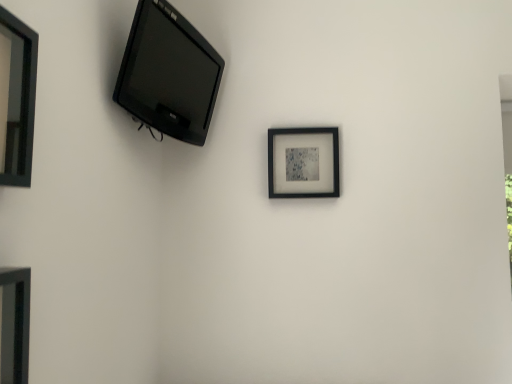
Measure the distance between point (144, 122) and camera.

The depth of point (144, 122) is 1.25 meters.

What is the approximate width of matte black tv at upper left?

It is 17.48 centimeters.

What do you see at coordinates (303, 162) in the screenshot?
I see `black matte picture frame at center, positioned as the first picture frame in back-to-front order` at bounding box center [303, 162].

How much space does black matte picture frame at center, the third picture frame in the left-to-right sequence, occupy vertically?

black matte picture frame at center, the third picture frame in the left-to-right sequence, is 10.20 inches in height.

This screenshot has width=512, height=384. What are the coordinates of `black glossy picture frame at upper left, the 2th picture frame when ordered from front to back` in the screenshot? It's located at (17, 99).

In order to click on matte black picture frame at lower left, which appears as the second picture frame when viewed from the right in this screenshot , I will do `click(14, 324)`.

I want to click on matte black tv at upper left, so click(168, 74).

Considering the sizes of objects black matte picture frame at center, the 1th picture frame when ordered from right to left, and matte black tv at upper left in the image provided, who is bigger, black matte picture frame at center, the 1th picture frame when ordered from right to left, or matte black tv at upper left?

matte black tv at upper left is bigger.

Considering the positions of objects black matte picture frame at center, the 1th picture frame when ordered from right to left, and matte black tv at upper left in the image provided, who is more to the left, black matte picture frame at center, the 1th picture frame when ordered from right to left, or matte black tv at upper left?

From the viewer's perspective, matte black tv at upper left appears more on the left side.

Who is taller, black matte picture frame at center, positioned as the first picture frame in back-to-front order, or matte black tv at upper left?

With more height is matte black tv at upper left.

Measure the distance from black matte picture frame at center, the third picture frame in the left-to-right sequence, to matte black tv at upper left.

black matte picture frame at center, the third picture frame in the left-to-right sequence, and matte black tv at upper left are 16.65 inches apart from each other.

Is black matte picture frame at center, the 1th picture frame when ordered from right to left, at the left side of matte black picture frame at lower left, which appears as the second picture frame when viewed from the right?

In fact, black matte picture frame at center, the 1th picture frame when ordered from right to left, is to the right of matte black picture frame at lower left, which appears as the second picture frame when viewed from the right.

Does black matte picture frame at center, the 1th picture frame when ordered from right to left, have a lesser height compared to matte black picture frame at lower left, marked as the 2th picture frame in a left-to-right arrangement?

Yes, black matte picture frame at center, the 1th picture frame when ordered from right to left, is shorter than matte black picture frame at lower left, marked as the 2th picture frame in a left-to-right arrangement.

Is black matte picture frame at center, positioned as the first picture frame in back-to-front order, smaller than matte black picture frame at lower left, which appears as the second picture frame when viewed from the right?

Correct, black matte picture frame at center, positioned as the first picture frame in back-to-front order, occupies less space than matte black picture frame at lower left, which appears as the second picture frame when viewed from the right.

Which object is wider, black matte picture frame at center, the 1th picture frame when ordered from right to left, or matte black picture frame at lower left, which appears as the second picture frame when viewed from the right?

matte black picture frame at lower left, which appears as the second picture frame when viewed from the right, is wider.

Considering the relative sizes of black glossy picture frame at upper left, which appears as the first picture frame when viewed from the left, and matte black picture frame at lower left, positioned as the third picture frame in back-to-front order, in the image provided, is black glossy picture frame at upper left, which appears as the first picture frame when viewed from the left, thinner than matte black picture frame at lower left, positioned as the third picture frame in back-to-front order,?

Indeed, black glossy picture frame at upper left, which appears as the first picture frame when viewed from the left, has a lesser width compared to matte black picture frame at lower left, positioned as the third picture frame in back-to-front order.

Is black glossy picture frame at upper left, marked as the 3th picture frame in a right-to-left arrangement, positioned with its back to matte black picture frame at lower left, which appears as the second picture frame when viewed from the right?

No, black glossy picture frame at upper left, marked as the 3th picture frame in a right-to-left arrangement,'s orientation is not away from matte black picture frame at lower left, which appears as the second picture frame when viewed from the right.

Based on the photo, considering the sizes of objects black glossy picture frame at upper left, the 2th picture frame when ordered from front to back, and matte black picture frame at lower left, which appears as the second picture frame when viewed from the right, in the image provided, who is smaller, black glossy picture frame at upper left, the 2th picture frame when ordered from front to back, or matte black picture frame at lower left, which appears as the second picture frame when viewed from the right,?

black glossy picture frame at upper left, the 2th picture frame when ordered from front to back, is smaller.

Can you tell me how much black glossy picture frame at upper left, the 2th picture frame when ordered from front to back, and matte black picture frame at lower left, which appears as the second picture frame when viewed from the right, differ in facing direction?

There is a 0.00387-degree angle between the facing directions of black glossy picture frame at upper left, the 2th picture frame when ordered from front to back, and matte black picture frame at lower left, which appears as the second picture frame when viewed from the right.

Can you tell me how much matte black tv at upper left and matte black picture frame at lower left, which appears as the second picture frame when viewed from the right, differ in facing direction?

There is a 16.3-degree angle between the facing directions of matte black tv at upper left and matte black picture frame at lower left, which appears as the second picture frame when viewed from the right.

Between matte black tv at upper left and matte black picture frame at lower left, positioned as the third picture frame in back-to-front order, which one is positioned in front?

matte black picture frame at lower left, positioned as the third picture frame in back-to-front order, is in front.

Is point (152, 27) closer or farther from the camera than point (12, 298)?

Clearly, point (152, 27) is more distant from the camera than point (12, 298).

Is matte black tv at upper left thinner than matte black picture frame at lower left, which appears as the second picture frame when viewed from the right?

No.

Which of these two, matte black tv at upper left or black matte picture frame at center, positioned as the first picture frame in back-to-front order, is wider?

matte black tv at upper left is wider.

Which object is more forward, matte black tv at upper left or black matte picture frame at center, the third picture frame in the front-to-back sequence?

matte black tv at upper left is more forward.

Which of these two, matte black tv at upper left or black matte picture frame at center, the third picture frame in the front-to-back sequence, is bigger?

matte black tv at upper left.

In the scene shown: From a real-world perspective, is matte black picture frame at lower left, which is counted as the 1th picture frame, starting from the front, beneath matte black tv at upper left?

Yes, from a real-world perspective, matte black picture frame at lower left, which is counted as the 1th picture frame, starting from the front, is below matte black tv at upper left.

Is matte black picture frame at lower left, which appears as the second picture frame when viewed from the right, not inside matte black tv at upper left?

matte black picture frame at lower left, which appears as the second picture frame when viewed from the right, is positioned outside matte black tv at upper left.

Can you confirm if matte black picture frame at lower left, positioned as the third picture frame in back-to-front order, is positioned to the right of matte black tv at upper left?

No, matte black picture frame at lower left, positioned as the third picture frame in back-to-front order, is not to the right of matte black tv at upper left.

Is matte black tv at upper left situated inside black glossy picture frame at upper left, the 2th picture frame when ordered from front to back, or outside?

matte black tv at upper left is spatially situated outside black glossy picture frame at upper left, the 2th picture frame when ordered from front to back.

Measure the distance from matte black tv at upper left to black glossy picture frame at upper left, marked as the 3th picture frame in a right-to-left arrangement.

matte black tv at upper left and black glossy picture frame at upper left, marked as the 3th picture frame in a right-to-left arrangement, are 23.37 inches apart.

Does matte black tv at upper left turn towards black glossy picture frame at upper left, which appears as the 2th picture frame when viewed from the back?

No, matte black tv at upper left is not aimed at black glossy picture frame at upper left, which appears as the 2th picture frame when viewed from the back.

Does matte black tv at upper left have a greater height compared to black glossy picture frame at upper left, which appears as the first picture frame when viewed from the left?

Yes.

At what (x,y) coordinates should I click in order to perform the action: click on television above the black matte picture frame at center, the 1th picture frame when ordered from right to left (from a real-world perspective). Please return your answer as a coordinate pair (x, y). Looking at the image, I should click on (168, 74).

The width and height of the screenshot is (512, 384). In order to click on the 2nd picture frame in front of the black matte picture frame at center, positioned as the first picture frame in back-to-front order, starting your count from the anchor in this screenshot , I will do `click(14, 324)`.

Estimate the real-world distances between objects in this image. Which object is further from matte black tv at upper left, black glossy picture frame at upper left, the 2th picture frame when ordered from front to back, or matte black picture frame at lower left, positioned as the third picture frame in back-to-front order?

matte black picture frame at lower left, positioned as the third picture frame in back-to-front order, is positioned further to the anchor matte black tv at upper left.

Looking at the image, which one is located further to black matte picture frame at center, the third picture frame in the front-to-back sequence, black glossy picture frame at upper left, marked as the 3th picture frame in a right-to-left arrangement, or matte black tv at upper left?

black glossy picture frame at upper left, marked as the 3th picture frame in a right-to-left arrangement, is further to black matte picture frame at center, the third picture frame in the front-to-back sequence.

Which object lies nearer to the anchor point matte black tv at upper left, black glossy picture frame at upper left, which appears as the 2th picture frame when viewed from the back, or black matte picture frame at center, the third picture frame in the left-to-right sequence?

Based on the image, black matte picture frame at center, the third picture frame in the left-to-right sequence, appears to be nearer to matte black tv at upper left.

Which object lies further to the anchor point black glossy picture frame at upper left, which appears as the first picture frame when viewed from the left, matte black picture frame at lower left, which is counted as the 1th picture frame, starting from the front, or black matte picture frame at center, the third picture frame in the left-to-right sequence?

The object further to black glossy picture frame at upper left, which appears as the first picture frame when viewed from the left, is black matte picture frame at center, the third picture frame in the left-to-right sequence.

Considering their positions, is matte black tv at upper left positioned closer to matte black picture frame at lower left, marked as the 2th picture frame in a left-to-right arrangement, than black glossy picture frame at upper left, the 2th picture frame when ordered from front to back?

black glossy picture frame at upper left, the 2th picture frame when ordered from front to back, lies closer to matte black picture frame at lower left, marked as the 2th picture frame in a left-to-right arrangement, than the other object.

From the image, which object appears to be nearer to matte black picture frame at lower left, positioned as the third picture frame in back-to-front order, black matte picture frame at center, the third picture frame in the left-to-right sequence, or matte black tv at upper left?

matte black tv at upper left is positioned closer to the anchor matte black picture frame at lower left, positioned as the third picture frame in back-to-front order.

When comparing their distances from black matte picture frame at center, the third picture frame in the front-to-back sequence, does matte black picture frame at lower left, marked as the 2th picture frame in a left-to-right arrangement, or black glossy picture frame at upper left, which appears as the 2th picture frame when viewed from the back, seem closer?

black glossy picture frame at upper left, which appears as the 2th picture frame when viewed from the back, is positioned closer to the anchor black matte picture frame at center, the third picture frame in the front-to-back sequence.

From the image, which object appears to be nearer to black glossy picture frame at upper left, the 2th picture frame when ordered from front to back, matte black tv at upper left or matte black picture frame at lower left, which appears as the second picture frame when viewed from the right?

matte black picture frame at lower left, which appears as the second picture frame when viewed from the right, lies closer to black glossy picture frame at upper left, the 2th picture frame when ordered from front to back, than the other object.

Image resolution: width=512 pixels, height=384 pixels. I want to click on picture frame positioned between matte black picture frame at lower left, which is counted as the 1th picture frame, starting from the front, and matte black tv at upper left from near to far, so click(17, 99).

You are a GUI agent. You are given a task and a screenshot of the screen. Output one action in this format:
    pyautogui.click(x=<x>, y=<y>)
    Task: Click on the television positioned between matte black picture frame at lower left, which appears as the second picture frame when viewed from the right, and black matte picture frame at center, the 1th picture frame when ordered from right to left, from near to far
    This screenshot has height=384, width=512.
    Given the screenshot: What is the action you would take?
    pyautogui.click(x=168, y=74)

This screenshot has width=512, height=384. I want to click on television between black glossy picture frame at upper left, which appears as the 2th picture frame when viewed from the back, and black matte picture frame at center, the third picture frame in the left-to-right sequence, from front to back, so click(168, 74).

I want to click on picture frame positioned between matte black picture frame at lower left, which appears as the second picture frame when viewed from the right, and black matte picture frame at center, the third picture frame in the front-to-back sequence, from near to far, so [17, 99].